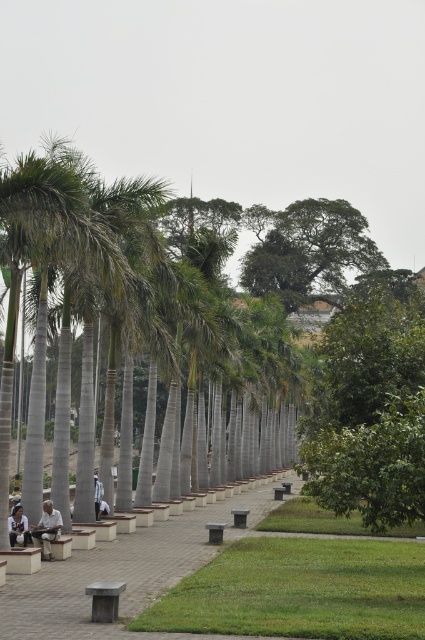
You are standing at the point marked as point (104, 600) in the image. What object is located exactly at this point?

The smooth gray bench at lower center is located exactly at point (104, 600).

You are standing at the point marked as point [309,252] in the scene. What object are you currently standing on?

You are standing on the green leafy tree at upper center.

You are standing at the entrance of the park and want to sit down. According to the image, where exactly is the gray concrete bench at center located?

The gray concrete bench at center is located at point [121,573].